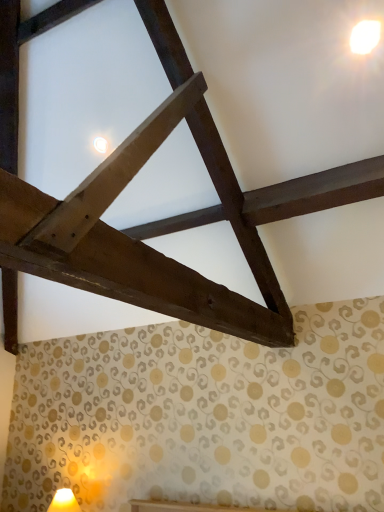
In order to face white glossy light at upper right, should I rotate leftwards or rightwards?

Rotate right and turn 22.438 degrees.

Locate an element on the screen. The image size is (384, 512). white glossy light at upper right is located at coordinates (365, 36).

What do you see at coordinates (365, 36) in the screenshot? I see `white glossy light at upper right` at bounding box center [365, 36].

The width and height of the screenshot is (384, 512). What do you see at coordinates (64, 502) in the screenshot?
I see `matte yellow table lamp at lower left` at bounding box center [64, 502].

The image size is (384, 512). Identify the location of matte yellow table lamp at lower left. (64, 502).

Locate an element on the screen. This screenshot has width=384, height=512. white glossy light at upper right is located at coordinates (365, 36).

Is matte yellow table lamp at lower left at the left side of white glossy light at upper right?

Correct, you'll find matte yellow table lamp at lower left to the left of white glossy light at upper right.

Is matte yellow table lamp at lower left closer to camera compared to white glossy light at upper right?

No, it is behind white glossy light at upper right.

Does point (79, 506) appear closer or farther from the camera than point (365, 36)?

Point (79, 506).

From the image's perspective, which one is positioned higher, matte yellow table lamp at lower left or white glossy light at upper right?

From the image's view, white glossy light at upper right is above.

From the picture: From a real-world perspective, which object stands above the other?

In real-world perspective, white glossy light at upper right is above.

Between matte yellow table lamp at lower left and white glossy light at upper right, which one has larger width?

matte yellow table lamp at lower left.

Considering the sizes of objects matte yellow table lamp at lower left and white glossy light at upper right in the image provided, who is taller, matte yellow table lamp at lower left or white glossy light at upper right?

With more height is matte yellow table lamp at lower left.

Who is bigger, matte yellow table lamp at lower left or white glossy light at upper right?

Bigger between the two is matte yellow table lamp at lower left.

Could white glossy light at upper right be considered to be inside matte yellow table lamp at lower left?

Definitely not — white glossy light at upper right is not inside matte yellow table lamp at lower left.

Are matte yellow table lamp at lower left and white glossy light at upper right located far from each other?

matte yellow table lamp at lower left is far away from white glossy light at upper right.

Is matte yellow table lamp at lower left looking in the opposite direction of white glossy light at upper right?

No.

How many degrees apart are the facing directions of matte yellow table lamp at lower left and white glossy light at upper right?

They differ by 3.29 degrees in their facing directions.

Image resolution: width=384 pixels, height=512 pixels. In order to click on table lamp that appears behind the white glossy light at upper right in this screenshot , I will do `click(64, 502)`.

Can you confirm if white glossy light at upper right is positioned to the right of matte yellow table lamp at lower left?

Yes.

Is white glossy light at upper right in front of or behind matte yellow table lamp at lower left in the image?

Visually, white glossy light at upper right is located in front of matte yellow table lamp at lower left.

Does point (371, 47) appear closer or farther from the camera than point (54, 505)?

Point (371, 47).

From the image's perspective, is white glossy light at upper right beneath matte yellow table lamp at lower left?

No.

From a real-world perspective, is white glossy light at upper right positioned over matte yellow table lamp at lower left based on gravity?

Yes.

Considering the sizes of objects white glossy light at upper right and matte yellow table lamp at lower left in the image provided, who is wider, white glossy light at upper right or matte yellow table lamp at lower left?

matte yellow table lamp at lower left.

Is white glossy light at upper right taller than matte yellow table lamp at lower left?

No, white glossy light at upper right is not taller than matte yellow table lamp at lower left.

Who is smaller, white glossy light at upper right or matte yellow table lamp at lower left?

Smaller between the two is white glossy light at upper right.

Is white glossy light at upper right located outside matte yellow table lamp at lower left?

Yes, white glossy light at upper right is located beyond the bounds of matte yellow table lamp at lower left.

Consider the image. Is white glossy light at upper right positioned far away from matte yellow table lamp at lower left?

Yes, white glossy light at upper right and matte yellow table lamp at lower left are quite far apart.

Is white glossy light at upper right facing towards matte yellow table lamp at lower left?

No, white glossy light at upper right is not turned towards matte yellow table lamp at lower left.

Can you tell me how much white glossy light at upper right and matte yellow table lamp at lower left differ in facing direction?

The angle between the facing direction of white glossy light at upper right and the facing direction of matte yellow table lamp at lower left is 3.29 degrees.

Identify the location of table lamp below the white glossy light at upper right (from a real-world perspective). (64, 502).

Where is `table lamp below the white glossy light at upper right (from a real-world perspective)`? Image resolution: width=384 pixels, height=512 pixels. table lamp below the white glossy light at upper right (from a real-world perspective) is located at coordinates (64, 502).

Identify the location of table lamp behind the white glossy light at upper right. This screenshot has width=384, height=512. (64, 502).